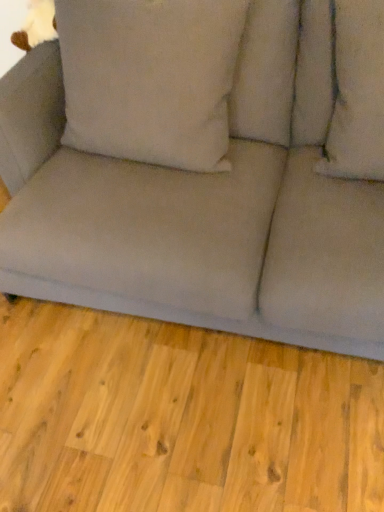
You are a GUI agent. You are given a task and a screenshot of the screen. Output one action in this format:
    pyautogui.click(x=<x>, y=<y>)
    Task: Click on the gray fabric couch at lower center
    
    Given the screenshot: What is the action you would take?
    [179, 418]

At what (x,y) coordinates should I click in order to perform the action: click on soft beige cushion at upper right, which ranks as the second pillow in left-to-right order. Please return your answer as a coordinate pair (x, y). This screenshot has width=384, height=512. Looking at the image, I should click on (356, 92).

Can you confirm if gray fabric couch at lower center is shorter than soft beige cushion at upper right, which ranks as the second pillow in left-to-right order?

Correct, gray fabric couch at lower center is not as tall as soft beige cushion at upper right, which ranks as the second pillow in left-to-right order.

Which object is positioned more to the left, gray fabric couch at lower center or soft beige cushion at upper right, the first pillow positioned from the right?

Positioned to the left is gray fabric couch at lower center.

Which is closer, (276, 493) or (338, 38)?

The point (276, 493) is more forward.

From a real-world perspective, is gray fabric couch at lower center positioned above or below soft beige cushion at upper right, the first pillow positioned from the right?

gray fabric couch at lower center is situated lower than soft beige cushion at upper right, the first pillow positioned from the right, in the real world.

Looking at their sizes, would you say gray fabric couch at lower center is wider or thinner than matte gray couch at center?

gray fabric couch at lower center is wider than matte gray couch at center.

Consider the image. Does gray fabric couch at lower center touch matte gray couch at center?

No, gray fabric couch at lower center is not beside matte gray couch at center.

You are a GUI agent. You are given a task and a screenshot of the screen. Output one action in this format:
    pyautogui.click(x=<x>, y=<y>)
    Task: Click on the studio couch that appears above the gray fabric couch at lower center (from the image's perspective)
    The width and height of the screenshot is (384, 512).
    Given the screenshot: What is the action you would take?
    pyautogui.click(x=214, y=187)

Is matte gray couch at center facing towards soft beige cushion at upper right, the first pillow positioned from the right?

No, matte gray couch at center is not facing towards soft beige cushion at upper right, the first pillow positioned from the right.

How many degrees apart are the facing directions of matte gray couch at center and soft beige cushion at upper right, the first pillow positioned from the right?

The angle between the facing direction of matte gray couch at center and the facing direction of soft beige cushion at upper right, the first pillow positioned from the right, is 0.401 degrees.

From a real-world perspective, is matte gray couch at center physically located above or below soft beige cushion at upper right, the first pillow positioned from the right?

In terms of real-world spatial position, matte gray couch at center is below soft beige cushion at upper right, the first pillow positioned from the right.

Is matte gray couch at center spatially inside soft beige cushion at upper right, the first pillow positioned from the right, or outside of it?

matte gray couch at center lies outside soft beige cushion at upper right, the first pillow positioned from the right.

Is gray fabric couch at lower center oriented towards beige fabric pillow at center, the second pillow from the right?

No.

Is point (150, 377) more distant than point (70, 66)?

Yes, it is behind point (70, 66).

From a real-world perspective, which is physically above, gray fabric couch at lower center or beige fabric pillow at center, which is counted as the first pillow, starting from the left?

beige fabric pillow at center, which is counted as the first pillow, starting from the left, is physically above.

At what (x,y) coordinates should I click in order to perform the action: click on plank below the beige fabric pillow at center, which is counted as the first pillow, starting from the left (from a real-world perspective). Please return your answer as a coordinate pair (x, y). The width and height of the screenshot is (384, 512). Looking at the image, I should click on (179, 418).

Is gray fabric couch at lower center at the back of beige fabric pillow at center, which is counted as the first pillow, starting from the left?

No.

Between beige fabric pillow at center, which is counted as the first pillow, starting from the left, and gray fabric couch at lower center, which one has larger size?

With larger size is beige fabric pillow at center, which is counted as the first pillow, starting from the left.

Is beige fabric pillow at center, the second pillow from the right, in front of or behind gray fabric couch at lower center in the image?

beige fabric pillow at center, the second pillow from the right, is positioned farther from the viewer than gray fabric couch at lower center.

From the image's perspective, would you say soft beige cushion at upper right, the first pillow positioned from the right, is shown under gray fabric couch at lower center?

Incorrect, from the image's perspective, soft beige cushion at upper right, the first pillow positioned from the right, is higher than gray fabric couch at lower center.

Choose the correct answer: Is soft beige cushion at upper right, which ranks as the second pillow in left-to-right order, inside gray fabric couch at lower center or outside it?

soft beige cushion at upper right, which ranks as the second pillow in left-to-right order, is outside gray fabric couch at lower center.

Is soft beige cushion at upper right, which ranks as the second pillow in left-to-right order, wider or thinner than gray fabric couch at lower center?

Considering their sizes, soft beige cushion at upper right, which ranks as the second pillow in left-to-right order, looks slimmer than gray fabric couch at lower center.

From the image's perspective, starting from the gray fabric couch at lower center, which pillow is the 1st one above? Please provide its 2D coordinates.

[(356, 92)]

Considering the sizes of objects beige fabric pillow at center, the second pillow from the right, and soft beige cushion at upper right, the first pillow positioned from the right, in the image provided, who is shorter, beige fabric pillow at center, the second pillow from the right, or soft beige cushion at upper right, the first pillow positioned from the right,?

With less height is soft beige cushion at upper right, the first pillow positioned from the right.

Does beige fabric pillow at center, the second pillow from the right, turn towards soft beige cushion at upper right, which ranks as the second pillow in left-to-right order?

No, beige fabric pillow at center, the second pillow from the right, does not turn towards soft beige cushion at upper right, which ranks as the second pillow in left-to-right order.

Between beige fabric pillow at center, the second pillow from the right, and soft beige cushion at upper right, which ranks as the second pillow in left-to-right order, which one has smaller width?

beige fabric pillow at center, the second pillow from the right, is thinner.

Between point (95, 106) and point (329, 142), which one is positioned behind?

The point (329, 142) is more distant.

Find the location of a particular element. Image resolution: width=384 pixels, height=512 pixels. plank on the left of the soft beige cushion at upper right, the first pillow positioned from the right is located at coordinates (179, 418).

Where is `studio couch above the gray fabric couch at lower center (from the image's perspective)`? studio couch above the gray fabric couch at lower center (from the image's perspective) is located at coordinates (214, 187).

From the image, which object appears to be nearer to beige fabric pillow at center, the second pillow from the right, matte gray couch at center or soft beige cushion at upper right, which ranks as the second pillow in left-to-right order?

matte gray couch at center is closer to beige fabric pillow at center, the second pillow from the right.

Looking at the image, which one is located closer to soft beige cushion at upper right, the first pillow positioned from the right, gray fabric couch at lower center or beige fabric pillow at center, which is counted as the first pillow, starting from the left?

beige fabric pillow at center, which is counted as the first pillow, starting from the left, is closer to soft beige cushion at upper right, the first pillow positioned from the right.

Looking at the image, which one is located closer to matte gray couch at center, beige fabric pillow at center, the second pillow from the right, or gray fabric couch at lower center?

beige fabric pillow at center, the second pillow from the right.

Based on their spatial positions, is soft beige cushion at upper right, the first pillow positioned from the right, or beige fabric pillow at center, the second pillow from the right, closer to gray fabric couch at lower center?

Based on the image, beige fabric pillow at center, the second pillow from the right, appears to be nearer to gray fabric couch at lower center.

From the image, which object appears to be farther from soft beige cushion at upper right, which ranks as the second pillow in left-to-right order, beige fabric pillow at center, which is counted as the first pillow, starting from the left, or matte gray couch at center?

beige fabric pillow at center, which is counted as the first pillow, starting from the left.

Which object lies further to the anchor point soft beige cushion at upper right, the first pillow positioned from the right, gray fabric couch at lower center or matte gray couch at center?

gray fabric couch at lower center.

When comparing their distances from gray fabric couch at lower center, does soft beige cushion at upper right, the first pillow positioned from the right, or matte gray couch at center seem closer?

matte gray couch at center is closer to gray fabric couch at lower center.

Which object lies nearer to the anchor point gray fabric couch at lower center, matte gray couch at center or soft beige cushion at upper right, which ranks as the second pillow in left-to-right order?

matte gray couch at center is closer to gray fabric couch at lower center.

Locate an element on the screen. The width and height of the screenshot is (384, 512). studio couch between beige fabric pillow at center, which is counted as the first pillow, starting from the left, and gray fabric couch at lower center vertically is located at coordinates pos(214,187).

This screenshot has height=512, width=384. In order to click on studio couch between beige fabric pillow at center, which is counted as the first pillow, starting from the left, and soft beige cushion at upper right, the first pillow positioned from the right, from left to right in this screenshot , I will do `click(214, 187)`.

Find the location of a particular element. pillow that lies between beige fabric pillow at center, which is counted as the first pillow, starting from the left, and gray fabric couch at lower center from top to bottom is located at coordinates (356, 92).

Locate an element on the screen. studio couch between soft beige cushion at upper right, which ranks as the second pillow in left-to-right order, and gray fabric couch at lower center vertically is located at coordinates (214, 187).